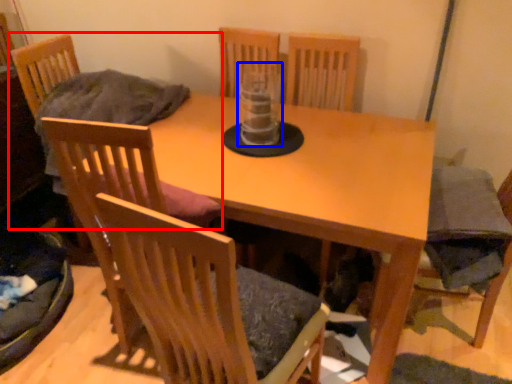
Question: Which object is further to the camera taking this photo, chair (highlighted by a red box) or glass vase (highlighted by a blue box)?

Choices:
 (A) chair
 (B) glass vase

Answer: (A)